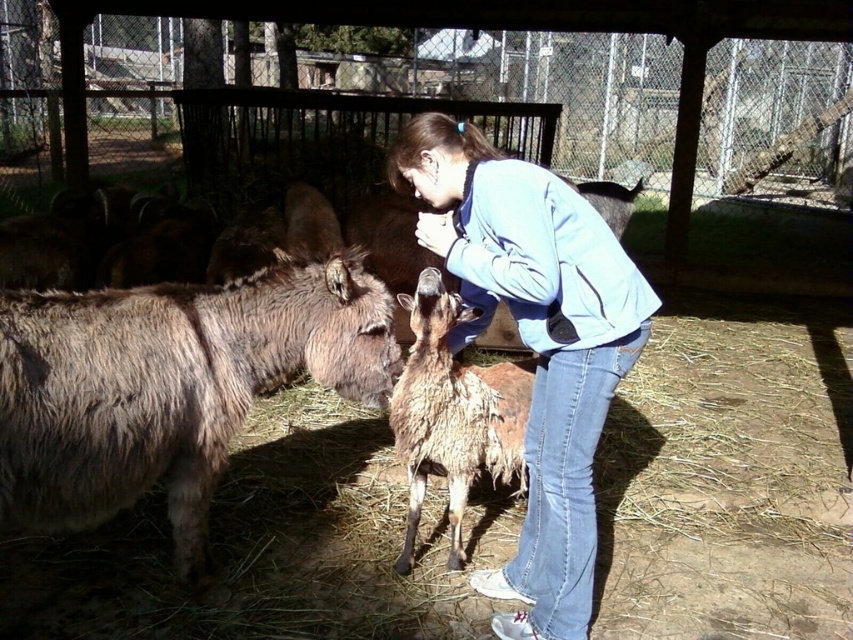
You are standing in the fenced enclosure and want to locate the fuzzy brown mule at left. According to the coordinates provided, where should you look to find it?

The fuzzy brown mule at left is located at coordinates point (x=169, y=385).

You are standing in a fenced enclosure with a young donkey and another animal. You notice a light blue denim jacket at center. Based on its position, can you determine if the jacket is closer to the donkey or the smaller animal to its right?

The light blue denim jacket at center is located at point [534,342]. Since the jacket is at the center, it is equidistant from both the donkey and the smaller animal to its right.